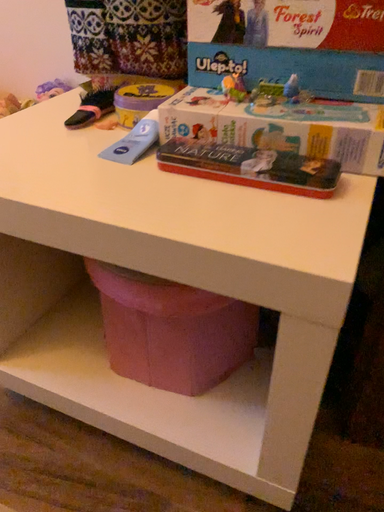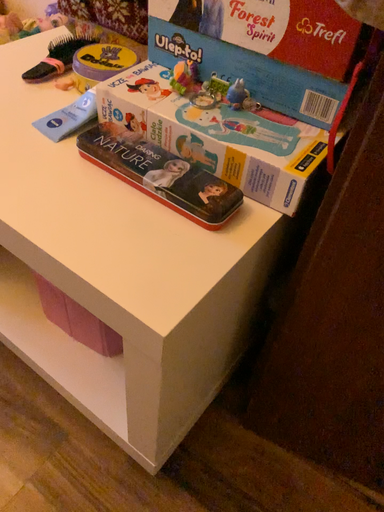
Question: How did the camera likely rotate when shooting the video?

Choices:
 (A) rotated upward
 (B) rotated downward

Answer: (B)